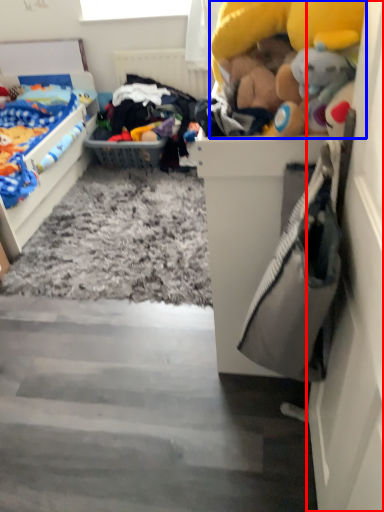
Question: Which object appears farthest to the camera in this image, door (highlighted by a red box) or toy (highlighted by a blue box)?

Choices:
 (A) door
 (B) toy

Answer: (B)